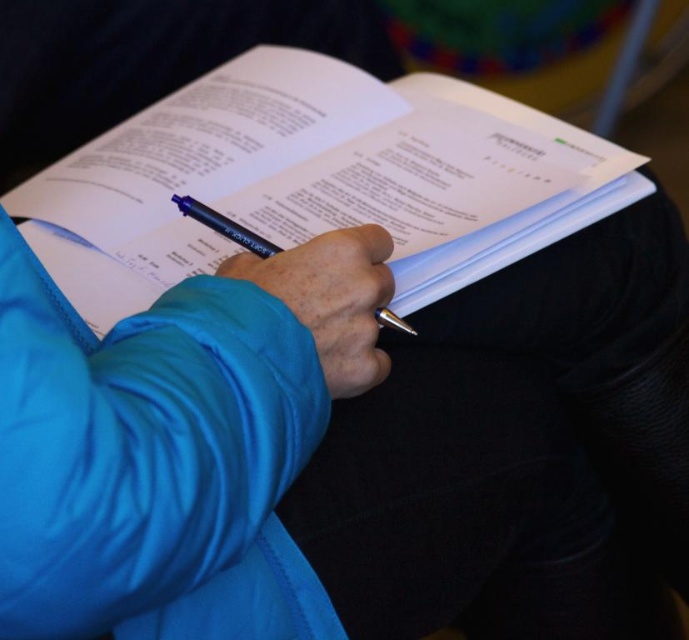
Question: Is the position of white paper at center less distant than that of metallic blue pen at center?

Choices:
 (A) yes
 (B) no

Answer: (B)

Question: Does blue fabric hand at center have a lesser width compared to metallic blue pen at center?

Choices:
 (A) yes
 (B) no

Answer: (A)

Question: Which object is the farthest from the white paper at center?

Choices:
 (A) metallic blue pen at center
 (B) blue fabric hand at center

Answer: (B)

Question: Considering the relative positions of white paper at center and blue fabric hand at center in the image provided, where is white paper at center located with respect to blue fabric hand at center?

Choices:
 (A) left
 (B) right

Answer: (A)

Question: Which is farther from the white paper at center?

Choices:
 (A) blue fabric hand at center
 (B) metallic blue pen at center

Answer: (A)

Question: Which point is closer to the camera?

Choices:
 (A) metallic blue pen at center
 (B) blue fabric hand at center
 (C) white paper at center

Answer: (B)